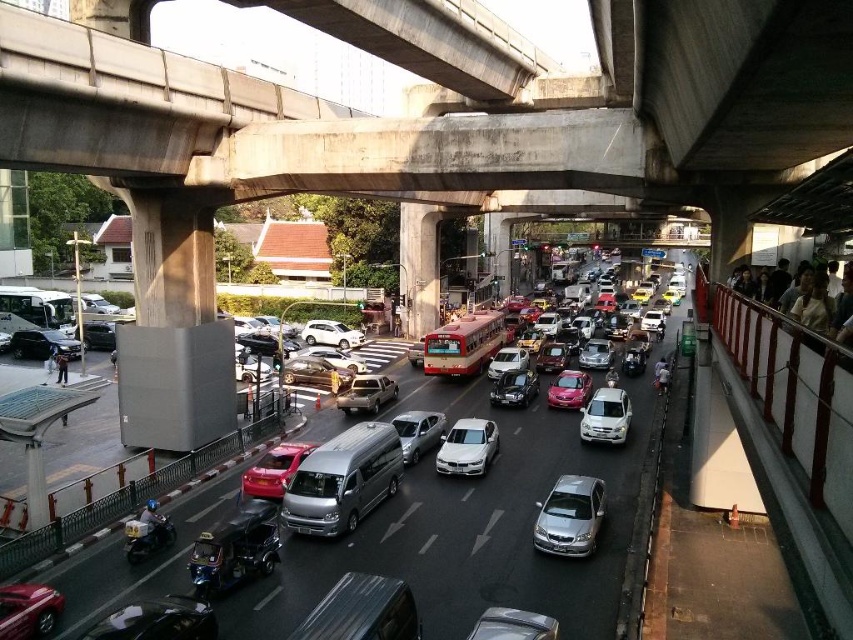
You are a pedestrian trying to cross the street from the left side of the image. You see the metallic silver van at center and the matte gray crowd at right. Which object is closer to your starting position?

The metallic silver van at center is closer to your starting position on the left side because it is positioned to the left of the matte gray crowd at right.

You are a delivery driver who needs to park your vehicle between the white metallic sedan at center and the metallic pink car at center. Your delivery van is 5 meters long. Is there enough space between these two cars for your van?

The white metallic sedan at center is bigger than the metallic pink car at center, but the exact distance between them is not provided. Without knowing the space between the two cars, it is impossible to determine if the 5 meter van can fit.